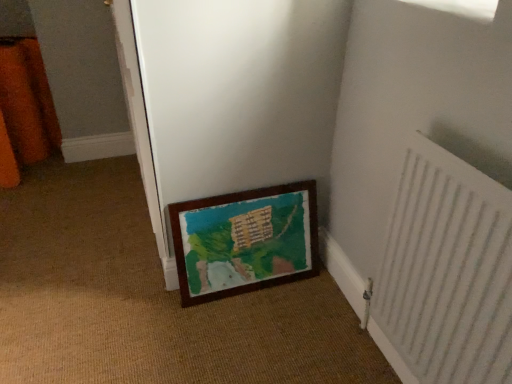
You are a GUI agent. You are given a task and a screenshot of the screen. Output one action in this format:
    pyautogui.click(x=<x>, y=<y>)
    Task: Click on the free space in front of wooden frame at lower center
    
    Given the screenshot: What is the action you would take?
    (x=251, y=333)